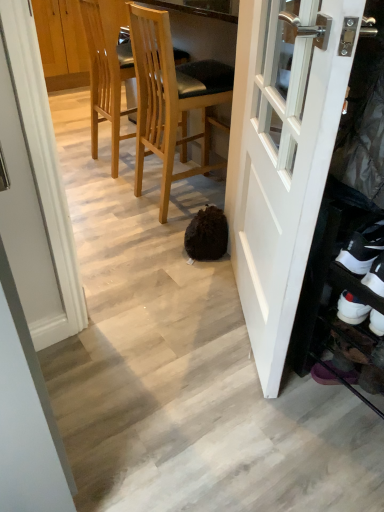
This screenshot has width=384, height=512. I want to click on vacant space underneath light brown wood chair at center, acting as the second chair starting from the left (from a real-world perspective), so click(193, 191).